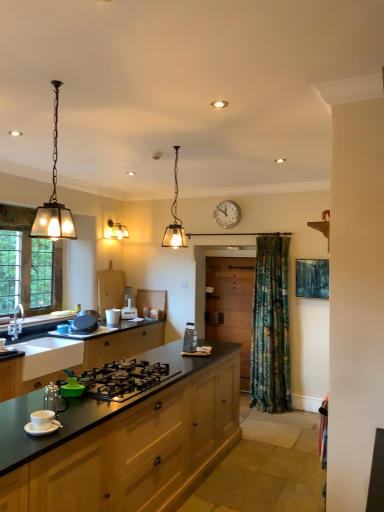
Question: Is white matte sink at lower left surrounding brushed metal faucet at left?

Choices:
 (A) no
 (B) yes

Answer: (A)

Question: Is white matte sink at lower left bigger than brushed metal faucet at left?

Choices:
 (A) yes
 (B) no

Answer: (A)

Question: Is white matte sink at lower left not close to brushed metal faucet at left?

Choices:
 (A) yes
 (B) no

Answer: (B)

Question: Could you tell me if white matte sink at lower left is facing brushed metal faucet at left?

Choices:
 (A) no
 (B) yes

Answer: (A)

Question: Considering the relative sizes of white matte sink at lower left and brushed metal faucet at left in the image provided, is white matte sink at lower left thinner than brushed metal faucet at left?

Choices:
 (A) yes
 (B) no

Answer: (B)

Question: Would you say white matte sink at lower left is outside brushed metal faucet at left?

Choices:
 (A) no
 (B) yes

Answer: (B)

Question: Considering the relative sizes of white glossy cup at center, the 2th appliance in the back-to-front sequence, and brushed metal faucet at left in the image provided, is white glossy cup at center, the 2th appliance in the back-to-front sequence, shorter than brushed metal faucet at left?

Choices:
 (A) yes
 (B) no

Answer: (A)

Question: From the image's perspective, is white glossy cup at center, placed as the second appliance when sorted from left to right, over brushed metal faucet at left?

Choices:
 (A) no
 (B) yes

Answer: (A)

Question: Is white glossy cup at center, the 2th appliance in the back-to-front sequence, far away from brushed metal faucet at left?

Choices:
 (A) yes
 (B) no

Answer: (A)

Question: Is white glossy cup at center, which appears as the fourth appliance when viewed from the front, to the right of brushed metal faucet at left from the viewer's perspective?

Choices:
 (A) no
 (B) yes

Answer: (B)

Question: Is white glossy cup at center, the 2th appliance in the back-to-front sequence, with brushed metal faucet at left?

Choices:
 (A) yes
 (B) no

Answer: (B)

Question: Considering the relative sizes of white glossy cup at center, which appears as the fourth appliance when viewed from the front, and brushed metal faucet at left in the image provided, is white glossy cup at center, which appears as the fourth appliance when viewed from the front, thinner than brushed metal faucet at left?

Choices:
 (A) yes
 (B) no

Answer: (A)

Question: Is the surface of white glossy cup at center, the 2th appliance in the back-to-front sequence, in direct contact with matte black countertop at lower left, the second cabinetry in the back-to-front sequence?

Choices:
 (A) no
 (B) yes

Answer: (A)